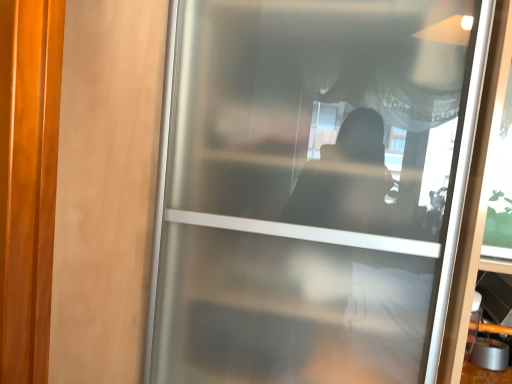
Describe the element at coordinates (311, 188) in the screenshot. I see `satin silver door at center` at that location.

What is the approximate height of satin silver door at center?

satin silver door at center is 5.29 feet in height.

The height and width of the screenshot is (384, 512). In order to click on satin silver door at center in this screenshot , I will do `click(311, 188)`.

What are the coordinates of `satin silver door at center` in the screenshot? It's located at (311, 188).